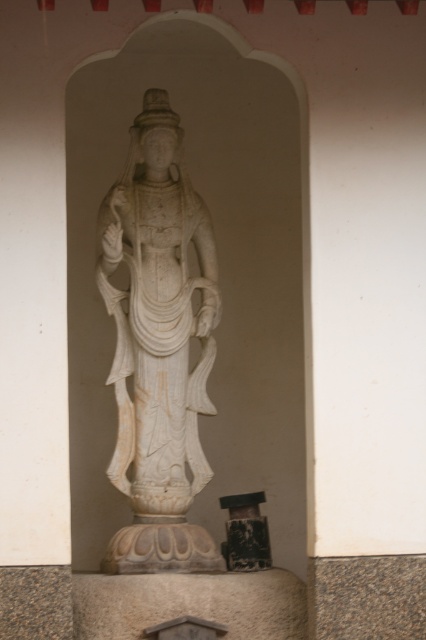
Question: Observing the image, what is the correct spatial positioning of white marble statue at center in reference to black textured pillar at center?

Choices:
 (A) right
 (B) left

Answer: (B)

Question: Among these points, which one is nearest to the camera?

Choices:
 (A) click(187, 432)
 (B) click(233, 556)

Answer: (B)

Question: Is white marble statue at center to the right of black textured pillar at center from the viewer's perspective?

Choices:
 (A) yes
 (B) no

Answer: (B)

Question: Is the position of white marble statue at center more distant than that of black textured pillar at center?

Choices:
 (A) yes
 (B) no

Answer: (B)